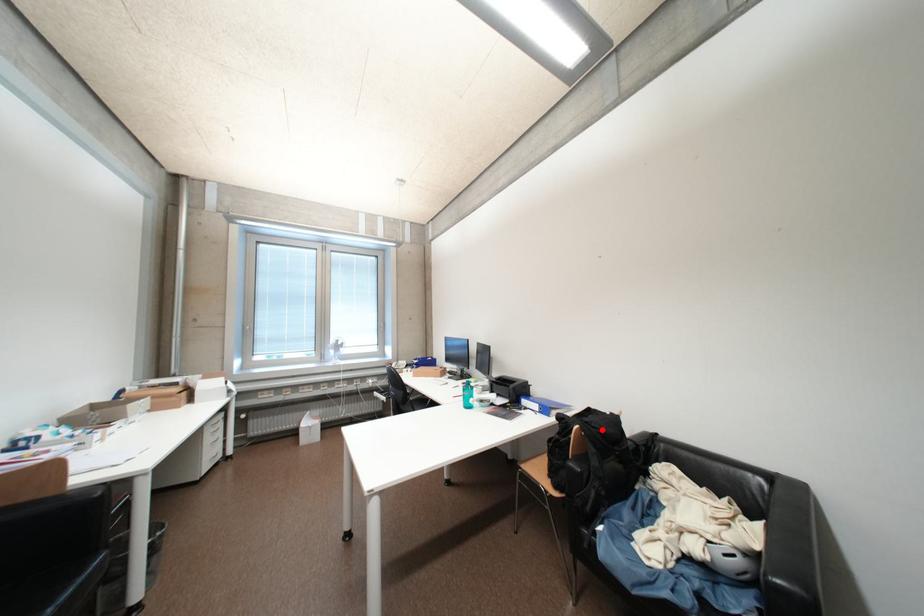
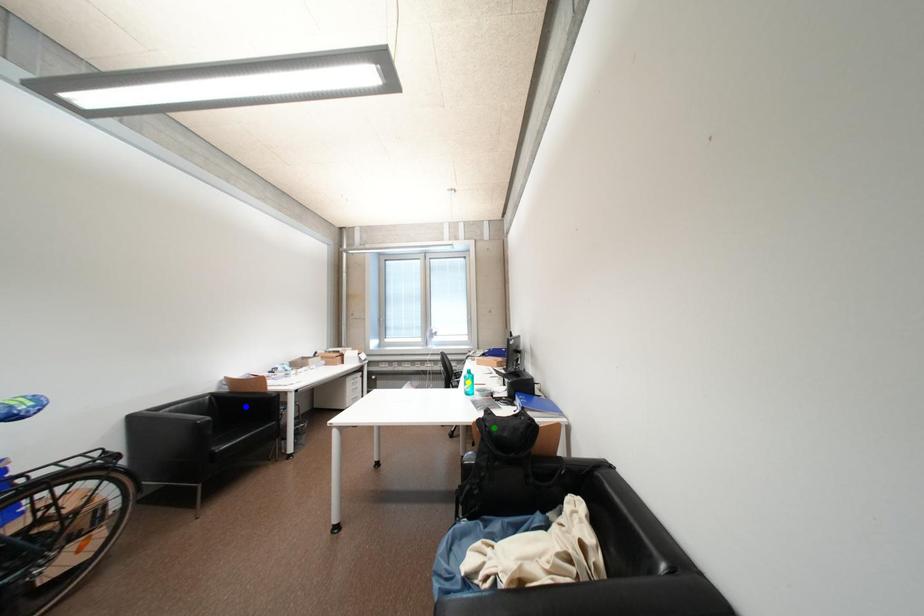
Question: I am providing you with two images of the same scene from different viewpoints. A red point is marked on the first image. You are given multiple points on the second image. In image 2, which mark is for the same physical point as the one in image 1?

Choices:
 (A) blue point
 (B) green point
 (C) yellow point

Answer: (B)